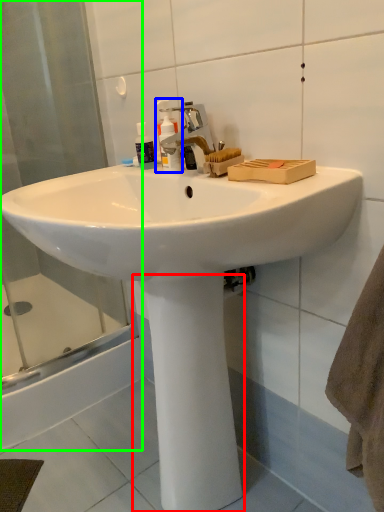
Question: Considering the real-world distances, which object is closest to pillar (highlighted by a red box)? cleaning product (highlighted by a blue box) or shower door (highlighted by a green box).

Choices:
 (A) cleaning product
 (B) shower door

Answer: (A)